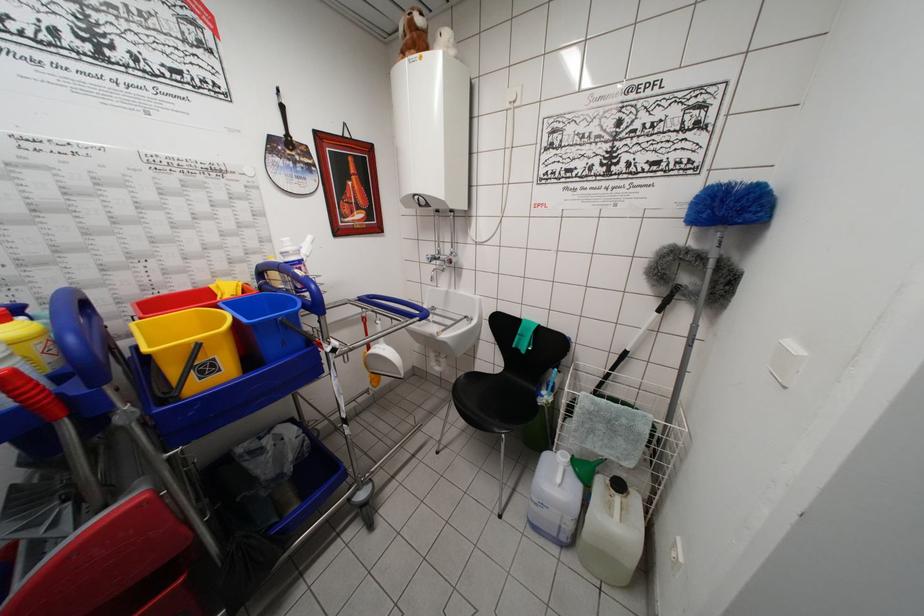
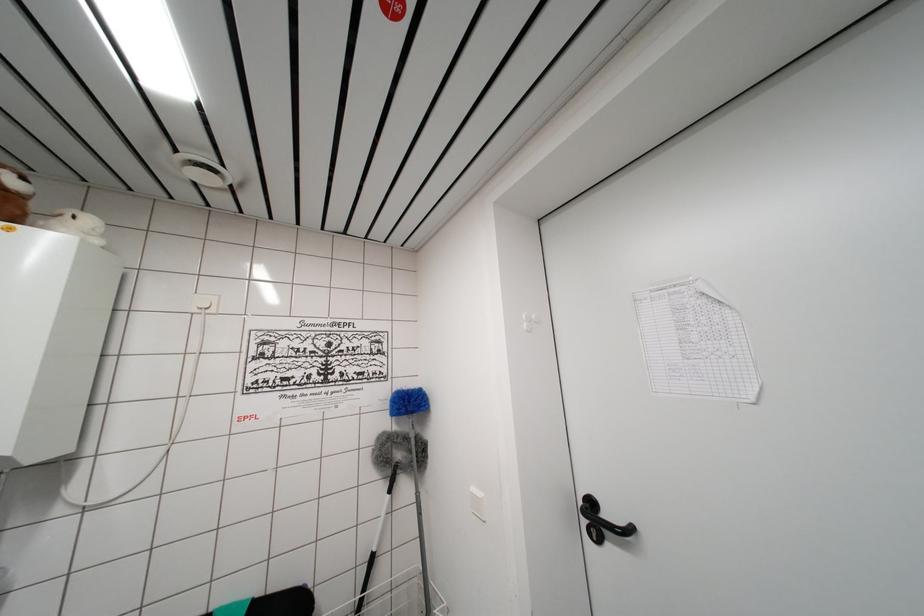
The images are taken continuously from a first-person perspective. In which direction is your viewpoint rotating?

The rotation direction of the camera is right-up.